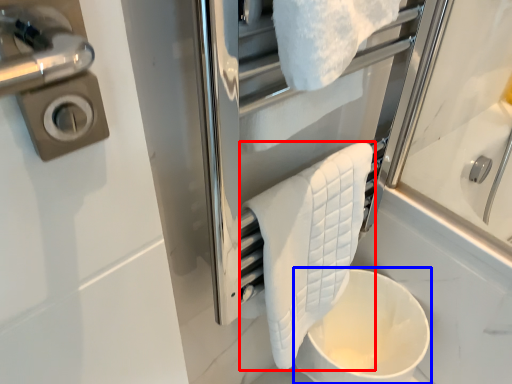
Question: Among these objects, which one is nearest to the camera, towel (highlighted by a red box) or toilet bowl (highlighted by a blue box)?

Choices:
 (A) towel
 (B) toilet bowl

Answer: (A)